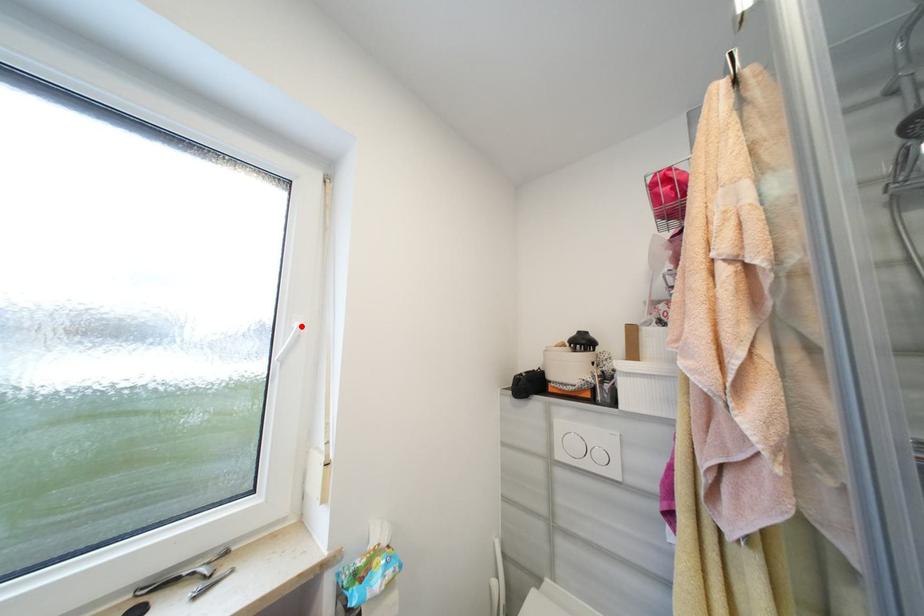
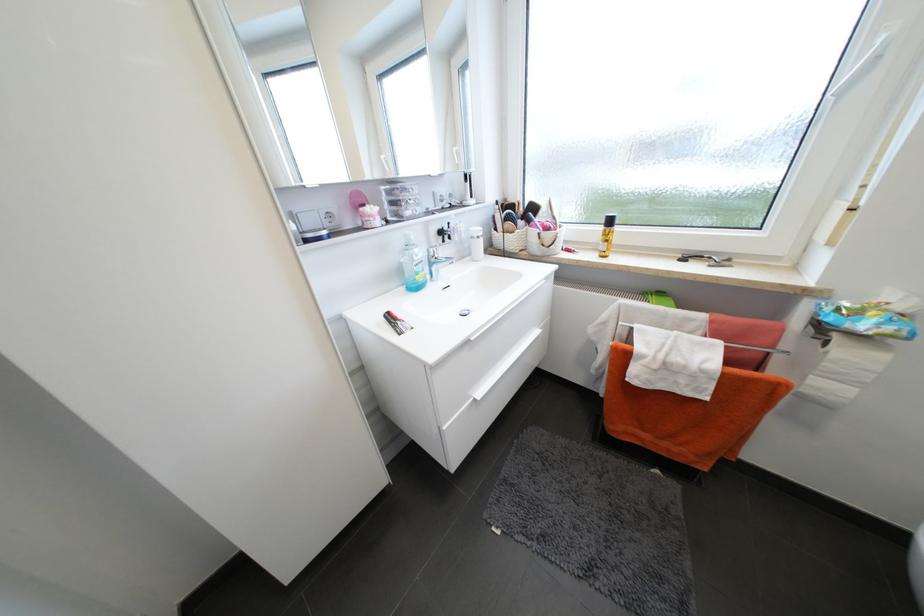
Where in the second image is the point corresponding to the highlighted location from the first image?

(888, 41)